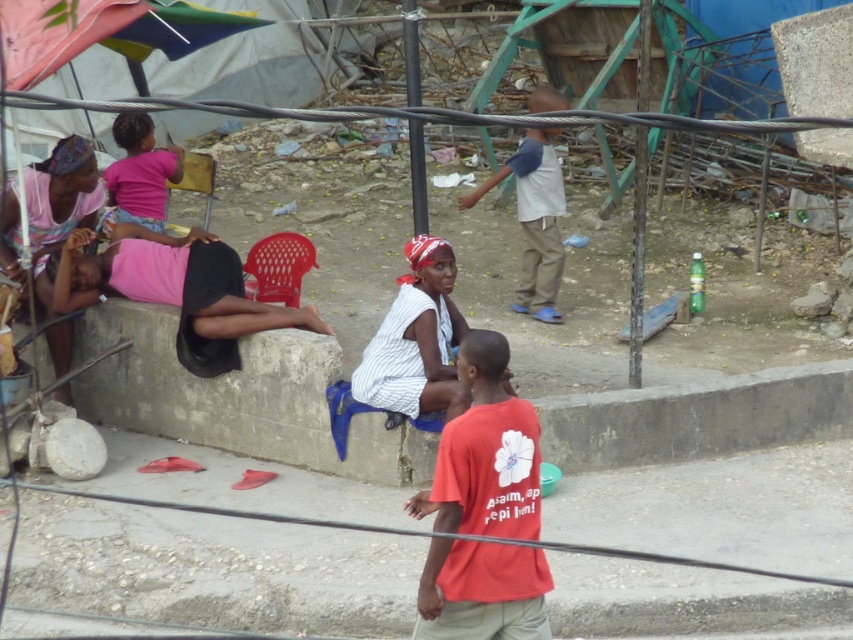
Question: Where is matte pink dress at left located in relation to pink fabric at upper left in the image?

Choices:
 (A) above
 (B) below

Answer: (B)

Question: Estimate the real-world distances between objects in this image. Which object is farther from the red cotton shirt at center?

Choices:
 (A) light blue denim pants at center
 (B) matte pink dress at left
 (C) white striped dress at center
 (D) pink fabric at upper left

Answer: (A)

Question: Which object is the closest to the matte pink dress at left?

Choices:
 (A) pink fabric at upper left
 (B) red cotton shirt at center
 (C) white striped dress at center

Answer: (A)

Question: Is pink fabric skirt at lower left above matte pink dress at left?

Choices:
 (A) no
 (B) yes

Answer: (A)

Question: Which point is farther to the camera?

Choices:
 (A) white striped dress at center
 (B) pink fabric at upper left
 (C) matte pink dress at left

Answer: (B)

Question: Can you confirm if pink fabric skirt at lower left is smaller than white striped dress at center?

Choices:
 (A) no
 (B) yes

Answer: (A)